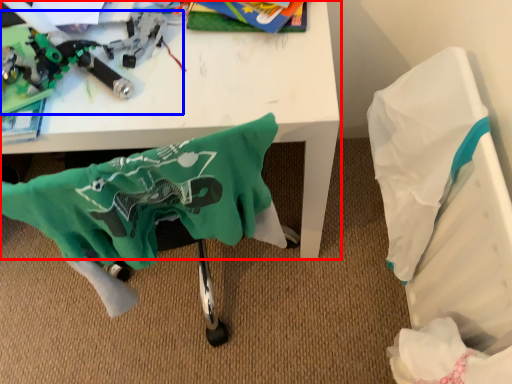
Question: Which of the following is the farthest to the observer, table (highlighted by a red box) or toy (highlighted by a blue box)?

Choices:
 (A) table
 (B) toy

Answer: (B)